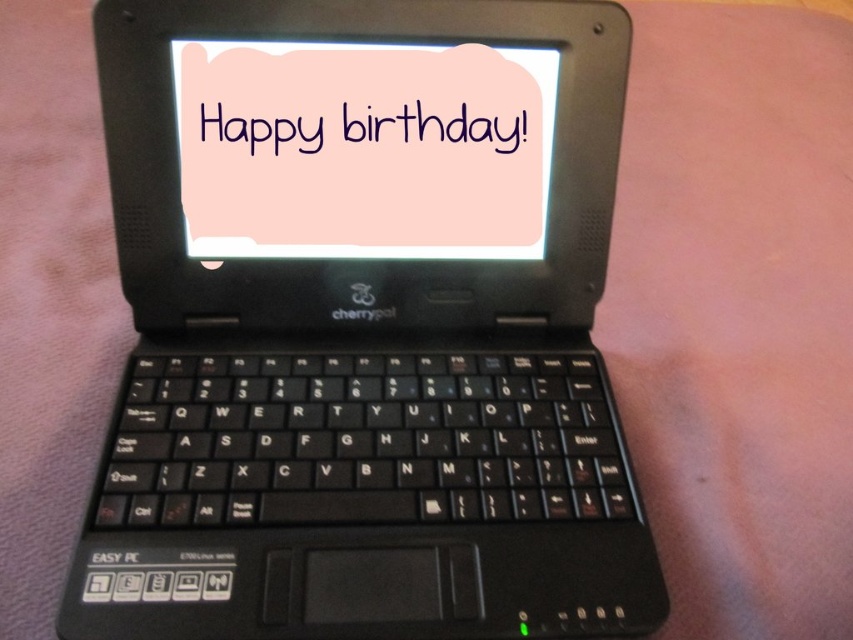
Question: Which point is farther from the camera taking this photo?

Choices:
 (A) (479, 321)
 (B) (492, 209)

Answer: (A)

Question: Which object is closer to the camera taking this photo?

Choices:
 (A) pink matte card at center
 (B) black plastic laptop at center

Answer: (B)

Question: Is black plastic laptop at center positioned before pink matte card at center?

Choices:
 (A) yes
 (B) no

Answer: (A)

Question: Which object is closer to the camera taking this photo?

Choices:
 (A) pink matte card at center
 (B) black plastic laptop at center

Answer: (B)

Question: Can you confirm if black plastic laptop at center is positioned to the left of pink matte card at center?

Choices:
 (A) yes
 (B) no

Answer: (B)

Question: Is black plastic laptop at center positioned before pink matte card at center?

Choices:
 (A) yes
 (B) no

Answer: (A)